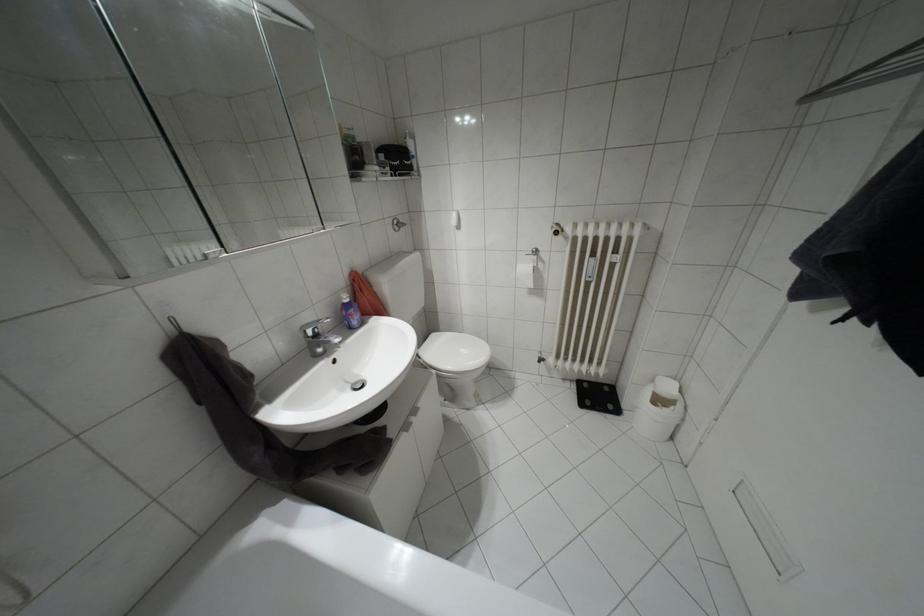
Where would you lift the toilet lid? Please return your answer as a coordinate pair (x, y).

(454, 352)